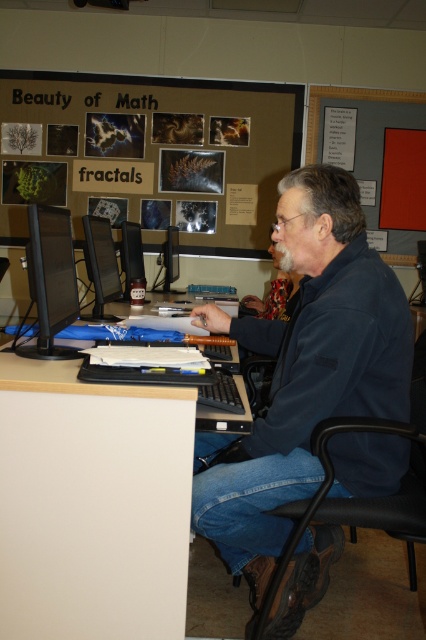
Can you confirm if smooth gray poster at upper right is smaller than matte black monitor at center?

Actually, smooth gray poster at upper right might be larger than matte black monitor at center.

Is smooth gray poster at upper right taller than matte black monitor at center?

Yes, smooth gray poster at upper right is taller than matte black monitor at center.

Where is `smooth gray poster at upper right`? This screenshot has height=640, width=426. smooth gray poster at upper right is located at coordinates (365, 125).

Can you confirm if black plastic swivel chair at lower right is wider than smooth gray poster at upper right?

In fact, black plastic swivel chair at lower right might be narrower than smooth gray poster at upper right.

Does black plastic swivel chair at lower right have a lesser height compared to smooth gray poster at upper right?

Yes.

This screenshot has height=640, width=426. I want to click on black plastic swivel chair at lower right, so click(365, 497).

Locate an element on the screen. The height and width of the screenshot is (640, 426). black plastic swivel chair at lower right is located at coordinates (365, 497).

Does white matte computer desk at lower left come in front of black plastic swivel chair at lower right?

Yes.

Who is shorter, white matte computer desk at lower left or black plastic swivel chair at lower right?

With less height is white matte computer desk at lower left.

Who is more distant from viewer, (x=57, y=468) or (x=385, y=432)?

Positioned behind is point (x=385, y=432).

Locate an element on the screen. white matte computer desk at lower left is located at coordinates (92, 502).